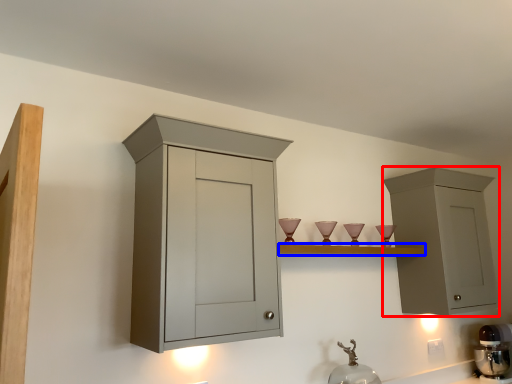
Question: Which point is further to the camera, cabinetry (highlighted by a red box) or shelf (highlighted by a blue box)?

Choices:
 (A) cabinetry
 (B) shelf

Answer: (A)